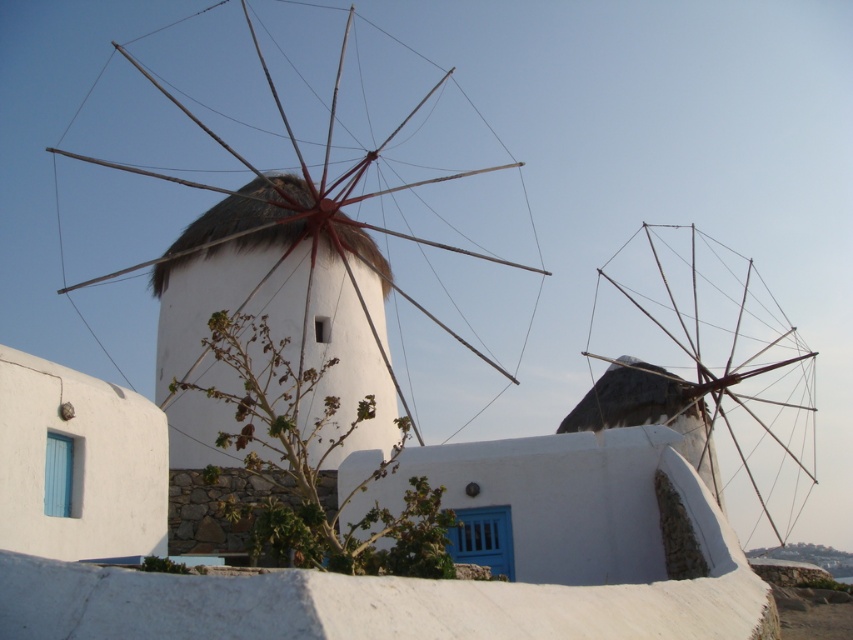
You are standing at the origin point in the image. Which direction should you move to reach the white thatched roof windmill at center?

The white thatched roof windmill at center is located at coordinates approximately 0.447 on the x axis and 0.332 on the y axis. Since you are at the origin point, you should move towards the northeast direction to reach it.

You are a tourist visiting the windmill area and want to take a photo that captures both the white thatched roof windmill at center and the wooden windmill at center. Which windmill has a larger width, making it more prominent in the photo?

The white thatched roof windmill at center has a larger width than the wooden windmill at center, making it more prominent in the photo.

You are a tourist visiting the windmills and want to take a photo that captures both the white thatched roof windmill at center and the wooden windmill at center. Which one should you focus on to ensure the larger one is clearly visible in the frame?

The white thatched roof windmill at center is bigger than the wooden windmill at center, so focusing on the white thatched roof windmill at center will ensure the larger one is clearly visible in the frame.